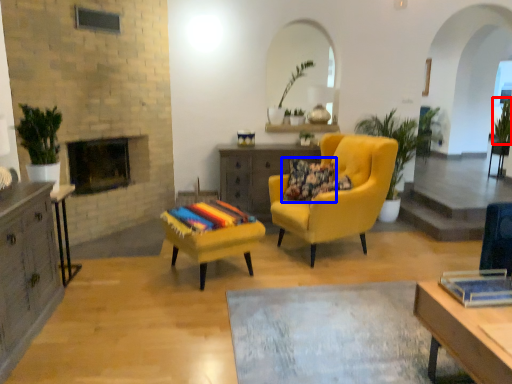
Question: Which object is further to the camera taking this photo, plant (highlighted by a red box) or pillow (highlighted by a blue box)?

Choices:
 (A) plant
 (B) pillow

Answer: (A)